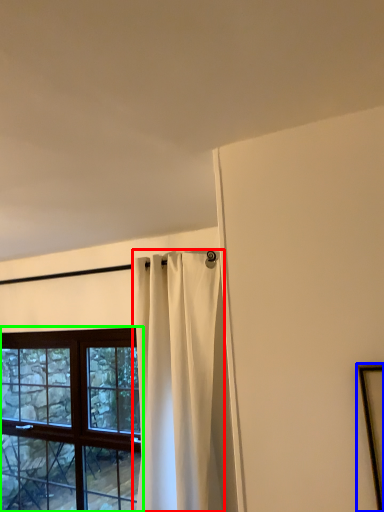
Question: Which is nearer to the curtain (highlighted by a red box)? picture frame (highlighted by a blue box) or window (highlighted by a green box).

Choices:
 (A) picture frame
 (B) window

Answer: (B)